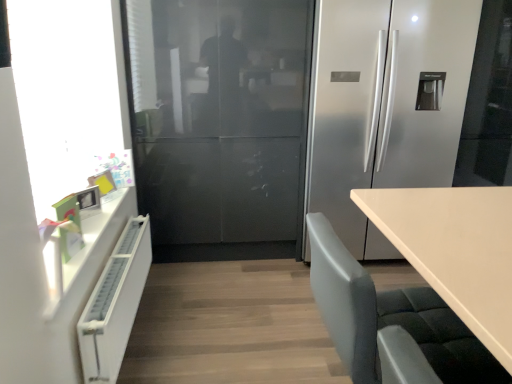
Question: Should I look upward or downward to see satin silver refrigerator at center?

Choices:
 (A) down
 (B) up

Answer: (B)

Question: From a real-world perspective, is satin silver refrigerator at center on top of white matte radiator at left?

Choices:
 (A) no
 (B) yes

Answer: (B)

Question: Does satin silver refrigerator at center have a greater height compared to white matte radiator at left?

Choices:
 (A) no
 (B) yes

Answer: (B)

Question: Does satin silver refrigerator at center appear on the left side of white matte radiator at left?

Choices:
 (A) yes
 (B) no

Answer: (B)

Question: Is satin silver refrigerator at center to the right of white matte radiator at left from the viewer's perspective?

Choices:
 (A) yes
 (B) no

Answer: (A)

Question: Considering the relative sizes of satin silver refrigerator at center and white matte radiator at left in the image provided, is satin silver refrigerator at center smaller than white matte radiator at left?

Choices:
 (A) no
 (B) yes

Answer: (A)

Question: Could you tell me if satin silver refrigerator at center is facing white matte radiator at left?

Choices:
 (A) no
 (B) yes

Answer: (A)

Question: Is transparent glass window screen at left positioned behind satin silver refrigerator at center?

Choices:
 (A) yes
 (B) no

Answer: (B)

Question: Is transparent glass window screen at left taller than satin silver refrigerator at center?

Choices:
 (A) yes
 (B) no

Answer: (B)

Question: Is transparent glass window screen at left not close to satin silver refrigerator at center?

Choices:
 (A) yes
 (B) no

Answer: (A)

Question: Is the depth of transparent glass window screen at left less than that of satin silver refrigerator at center?

Choices:
 (A) yes
 (B) no

Answer: (A)

Question: From a real-world perspective, is transparent glass window screen at left below satin silver refrigerator at center?

Choices:
 (A) no
 (B) yes

Answer: (A)

Question: Can you confirm if transparent glass window screen at left is bigger than satin silver refrigerator at center?

Choices:
 (A) yes
 (B) no

Answer: (B)

Question: Is white matte radiator at left turned away from gray fabric chair at lower right?

Choices:
 (A) no
 (B) yes

Answer: (A)